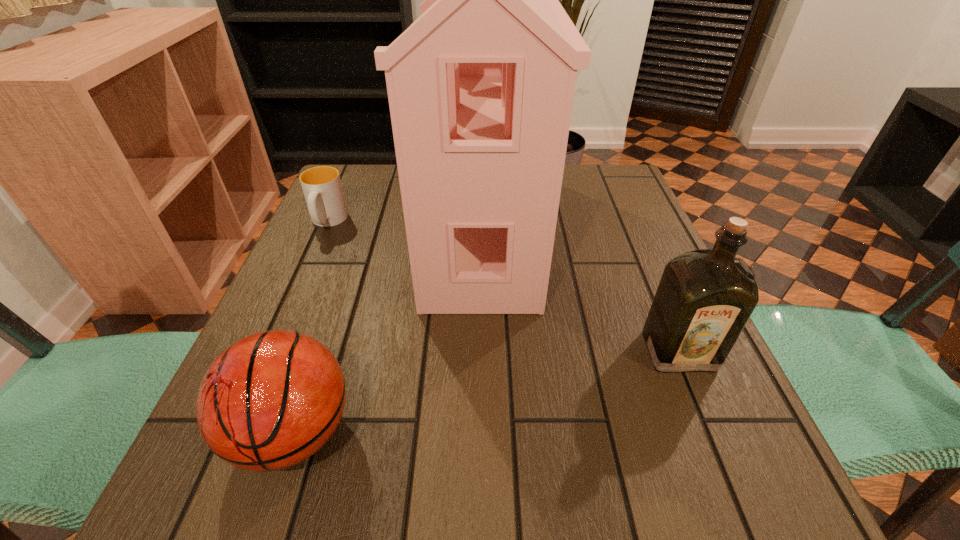
Where is `free space between the shortest object and the second shortest object`? The height and width of the screenshot is (540, 960). free space between the shortest object and the second shortest object is located at coordinates (311, 327).

Identify the location of free space between the third farthest object and the third tallest object. The height and width of the screenshot is (540, 960). (487, 392).

Identify the location of vacant area that lies between the second object from right to left and the third tallest object. (388, 330).

Where is `object that stands as the closest to the basketball`? object that stands as the closest to the basketball is located at coordinates (480, 87).

Identify the location of object that stands as the third closest to the dollhouse. The image size is (960, 540). (322, 188).

Where is `free space that satisfies the following two spatial constraints: 1. on the front-facing side of the dollhouse; 2. on the side with spill of the basketball`? The image size is (960, 540). free space that satisfies the following two spatial constraints: 1. on the front-facing side of the dollhouse; 2. on the side with spill of the basketball is located at coordinates (482, 433).